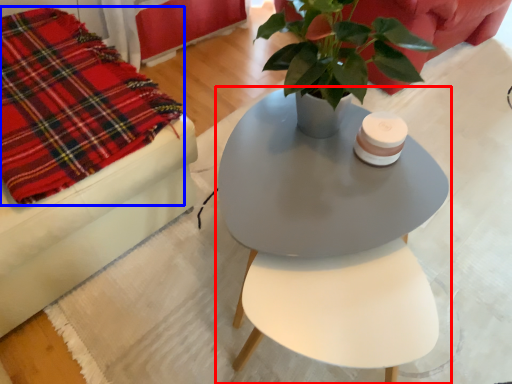
Question: Which object appears closest to the camera in this image, table (highlighted by a red box) or cloth (highlighted by a blue box)?

Choices:
 (A) table
 (B) cloth

Answer: (A)